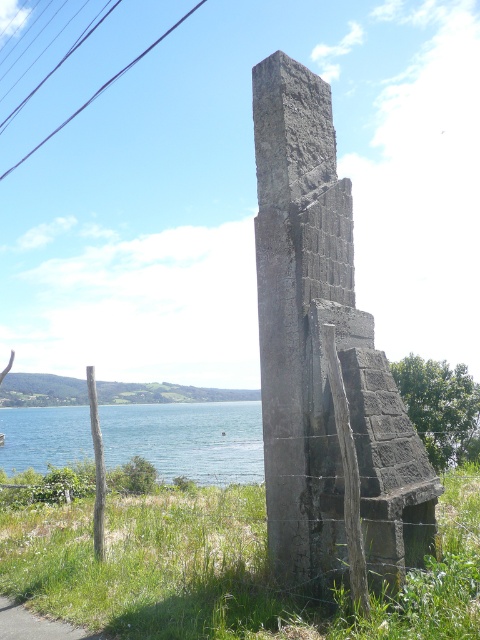
Does gray stone monument at center have a smaller size compared to blue water at lower left?

Correct, gray stone monument at center occupies less space than blue water at lower left.

Between gray stone monument at center and blue water at lower left, which one appears on the left side from the viewer's perspective?

From the viewer's perspective, blue water at lower left appears more on the left side.

The image size is (480, 640). I want to click on gray stone monument at center, so click(323, 355).